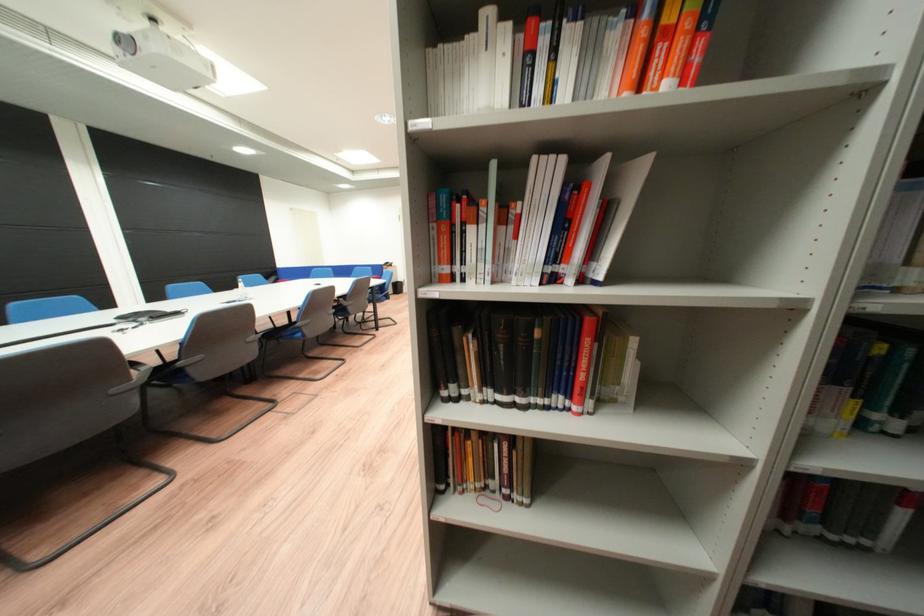
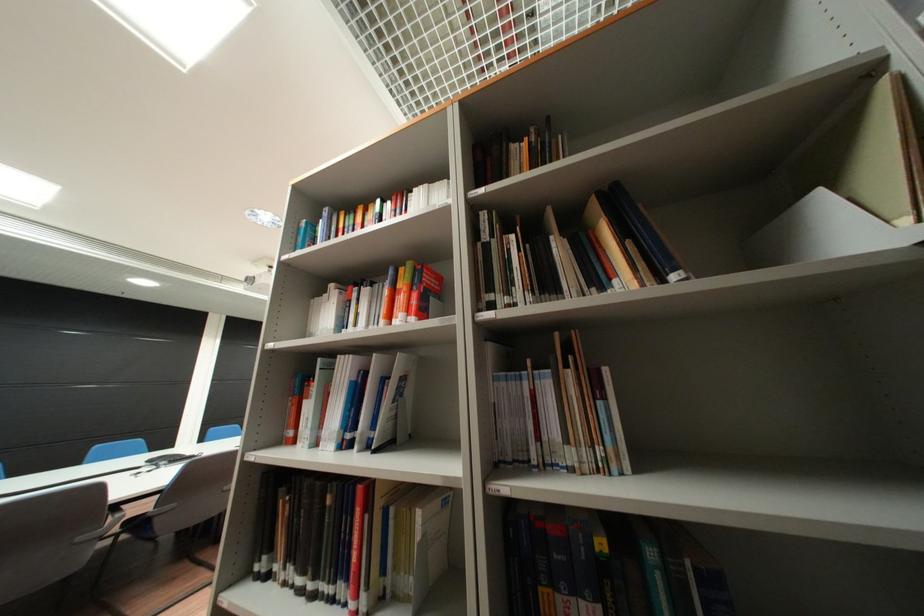
Find the pixel in the second image that matches pixel 687 83 in the first image.

(416, 315)